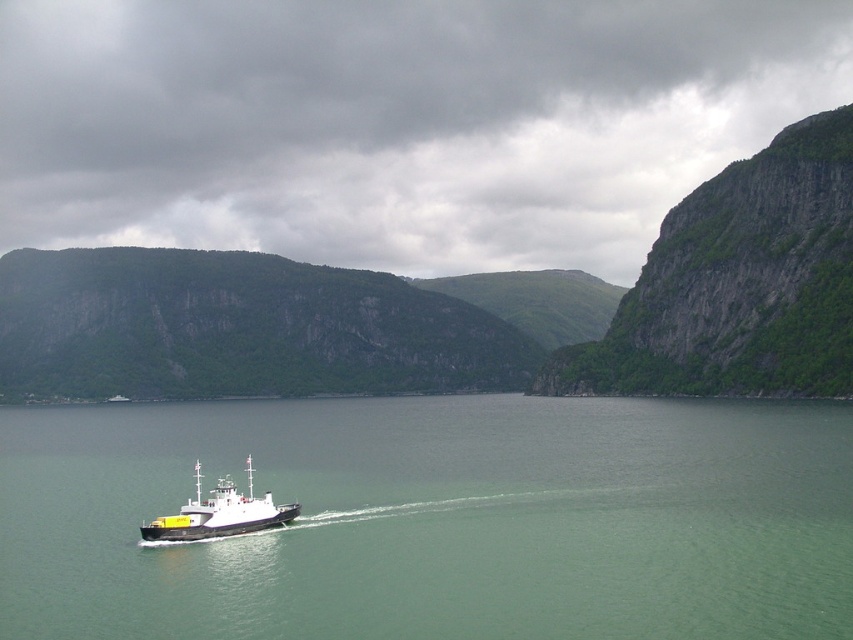
You are standing on the deck of the ferry boat and looking out towards the green rocky cliff at upper right and the green water at center. Which object appears taller from your vantage point?

The green rocky cliff at upper right appears taller than the green water at center from your vantage point on the ferry boat deck.

You are standing on the ferry boat and want to determine which of the two points, point (814,240) or point (294,506), is closer to you. Based on their positions, which point is nearer?

Point (814,240) is closer to you because it is further to the viewer than point (294,506).